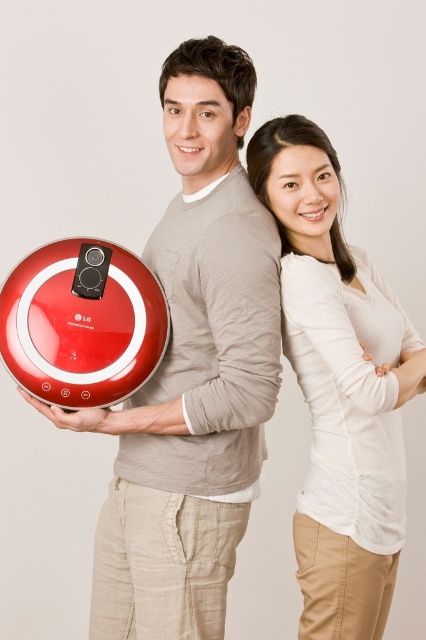
You are standing at point [255,220] and want to take a photo of the two people in the scene. The camera you have is 1.34 meters away from you. Can you capture both individuals in the frame without moving the camera?

Yes, since the camera is exactly 1.34 meters away from point [255,220], you can capture both individuals in the frame without moving the camera.

You are taking a photo of two people standing against a wall. You want to focus on the person closer to the camera. Which point should you focus on, point (265, 387) or point (13, 328)?

Point (265, 387) is closer to the camera than point (13, 328), so you should focus on point (265, 387) to capture the person closer to the camera.

You are a delivery person who needs to place a small package between the matte white blouse at center and the red plastic vacuum cleaner at lower left. Can you fit it there if the package is 16 inches long?

The distance between the matte white blouse at center and the red plastic vacuum cleaner at lower left is 16.26 inches. Since the package is 16 inches long, it should fit comfortably between them with a little extra space.